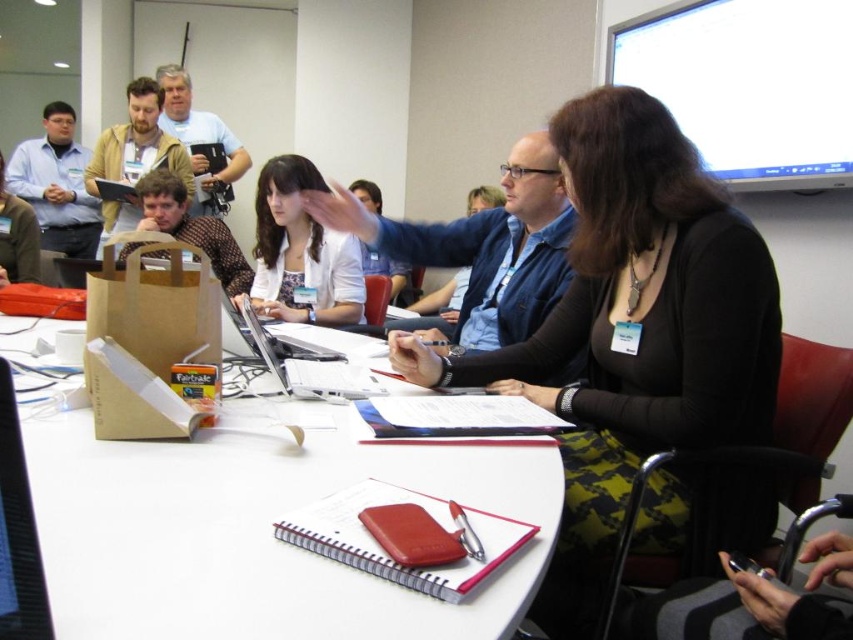
Question: Which point appears closest to the camera in this image?

Choices:
 (A) 325,300
 (B) 178,204
 (C) 82,252
 (D) 625,440

Answer: (D)

Question: Among these objects, which one is farthest from the camera?

Choices:
 (A) black jersey at center
 (B) matte white shirt at center

Answer: (B)

Question: Is white glossy monitor at upper right to the right of matte brown paper bag at upper left from the viewer's perspective?

Choices:
 (A) yes
 (B) no

Answer: (A)

Question: From the image, what is the correct spatial relationship of matte blue shirt at upper left in relation to matte brown paper bag at upper left?

Choices:
 (A) right
 (B) left

Answer: (B)

Question: Is white glossy monitor at upper right positioned in front of matte white shirt at center?

Choices:
 (A) yes
 (B) no

Answer: (A)

Question: Which point is closer to the camera?

Choices:
 (A) (656, 198)
 (B) (62, 195)

Answer: (A)